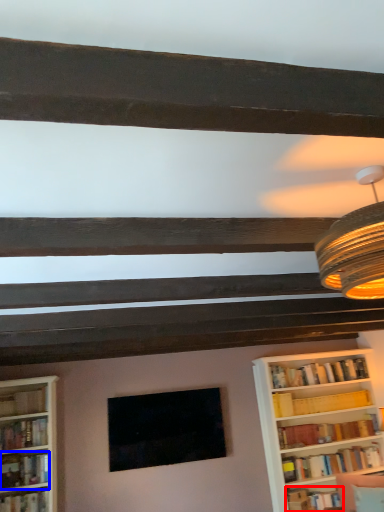
Question: Which point is further to the camera, book (highlighted by a red box) or book (highlighted by a blue box)?

Choices:
 (A) book
 (B) book

Answer: (A)